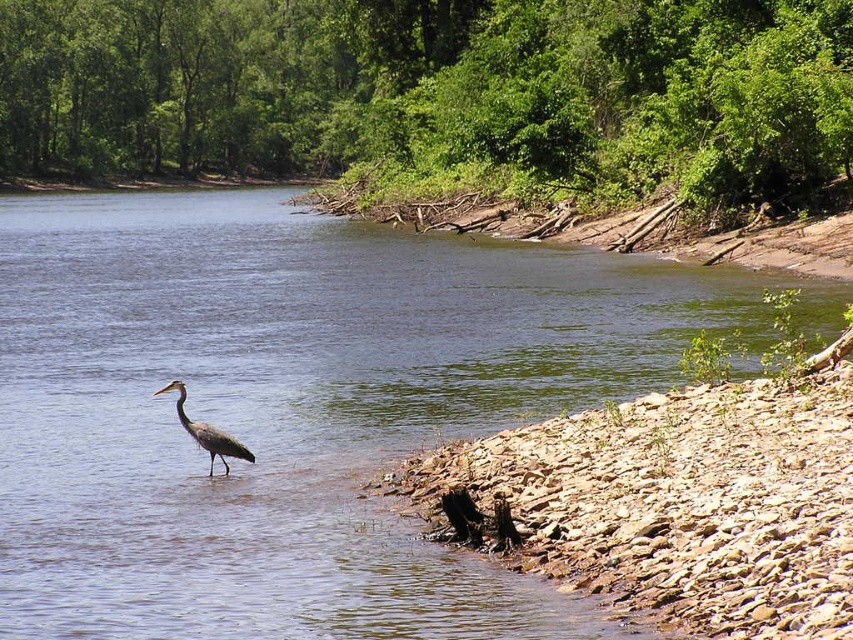
Is blue water at center closer to the viewer compared to gray matte bird at center?

Yes.

Can you confirm if blue water at center is taller than gray matte bird at center?

Indeed, blue water at center has a greater height compared to gray matte bird at center.

Image resolution: width=853 pixels, height=640 pixels. What do you see at coordinates (297, 406) in the screenshot?
I see `blue water at center` at bounding box center [297, 406].

Image resolution: width=853 pixels, height=640 pixels. I want to click on blue water at center, so click(297, 406).